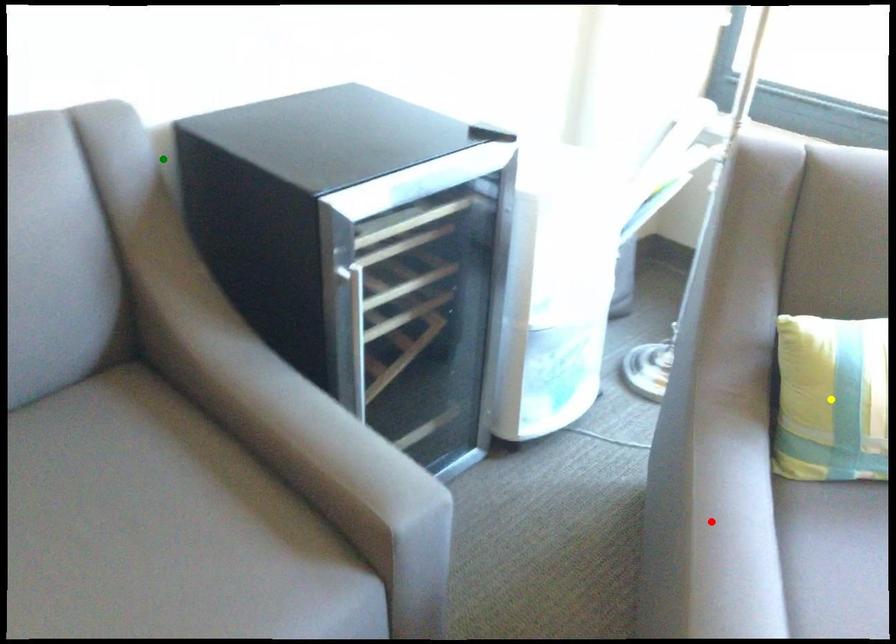
Order these from nearest to farthest:
- green point
- red point
- yellow point

red point → yellow point → green point